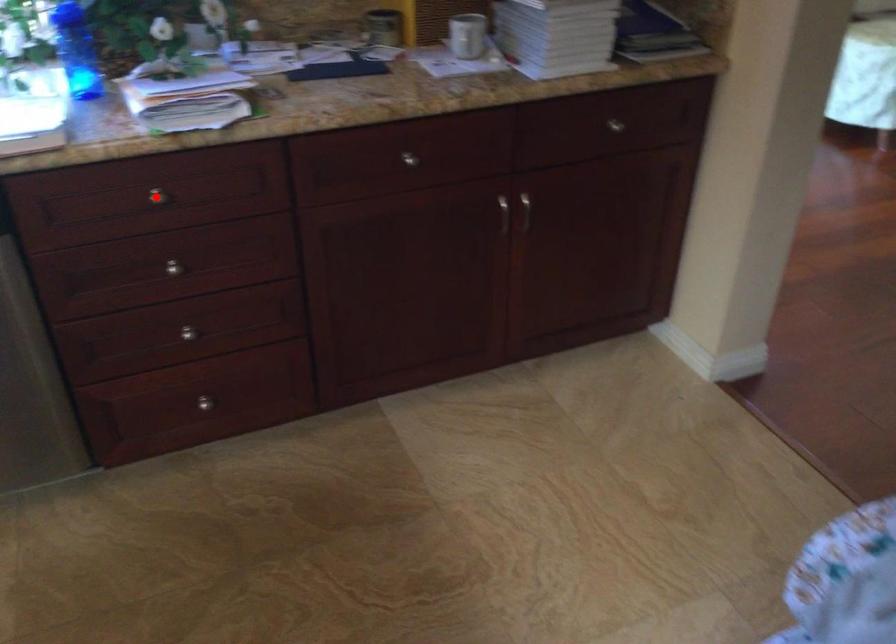
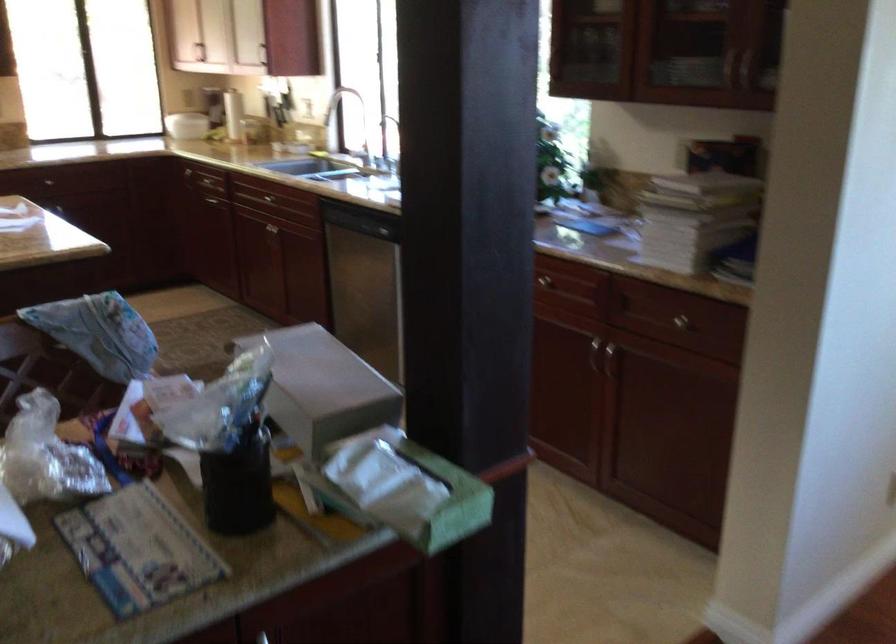
Question: I am providing you with two images of the same scene from different viewpoints. A red point is marked on the first image. Is the red point's position out of view in image 2?

Choices:
 (A) Yes
 (B) No

Answer: (A)